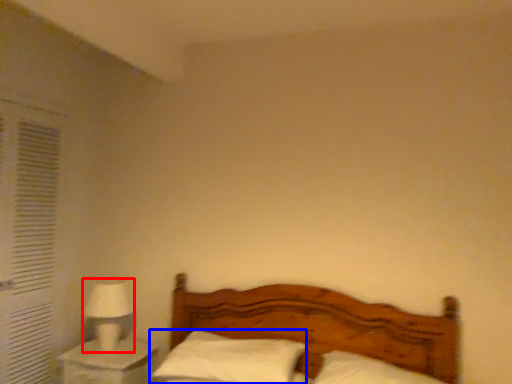
Question: Which object is closer to the camera taking this photo, table lamp (highlighted by a red box) or pillow (highlighted by a blue box)?

Choices:
 (A) table lamp
 (B) pillow

Answer: (B)